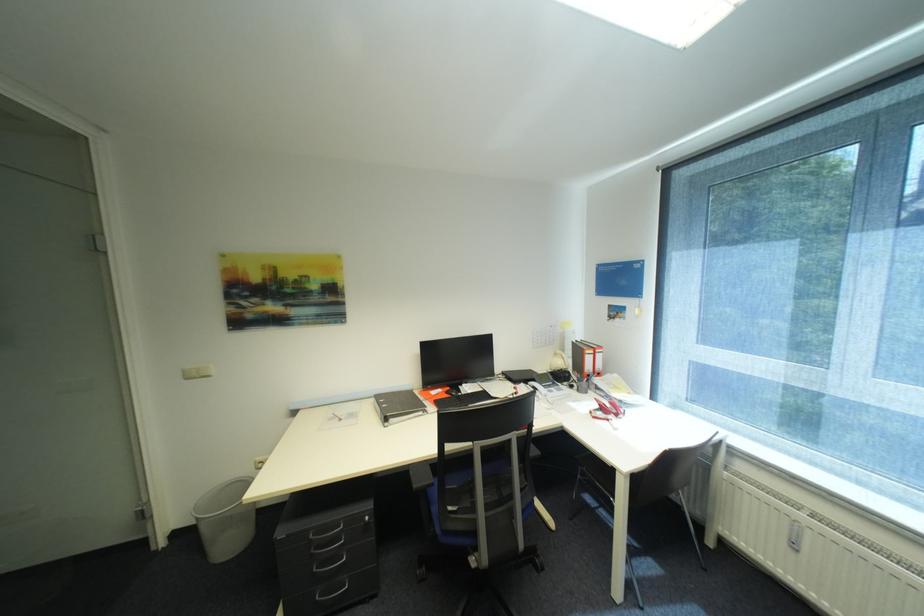
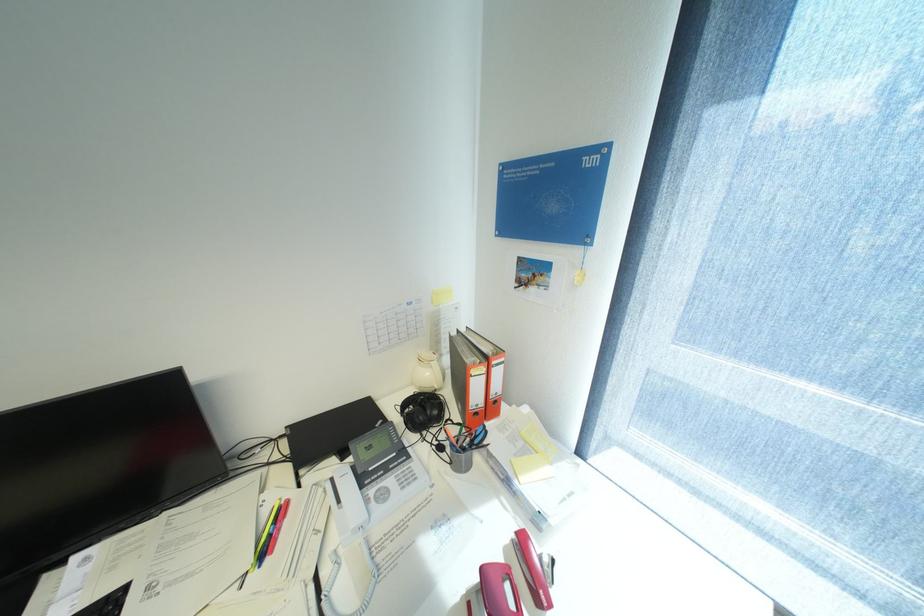
Which direction would the cameraman need to move to produce the second image?

The cameraman moved toward right, forward.